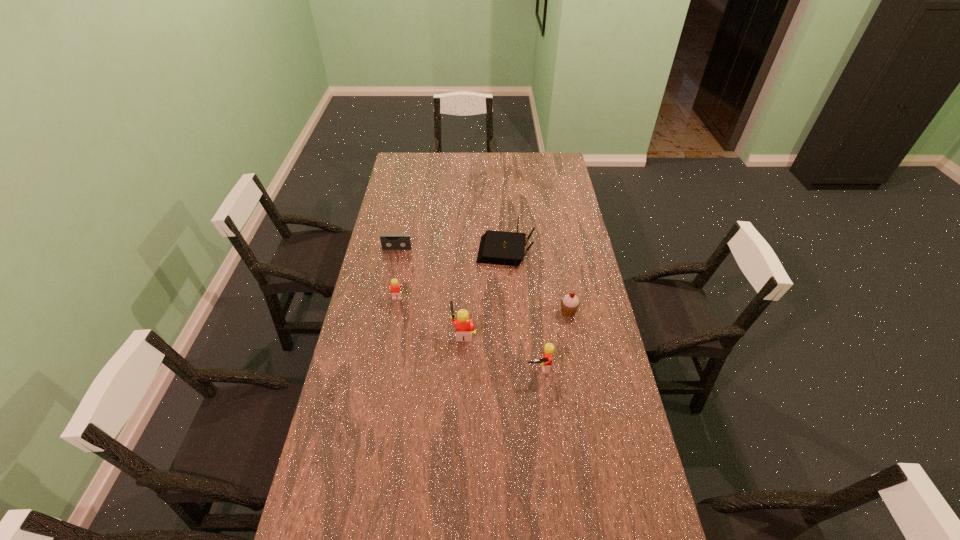
At what (x,y) coordinates should I click in order to perform the action: click on free space that satisfies the following two spatial constraints: 1. on the back side of the cupcake; 2. in front of the farthest Lego with the accessory visible. Please return your answer as a coordinate pair (x, y). Image resolution: width=960 pixels, height=540 pixels. Looking at the image, I should click on (566, 301).